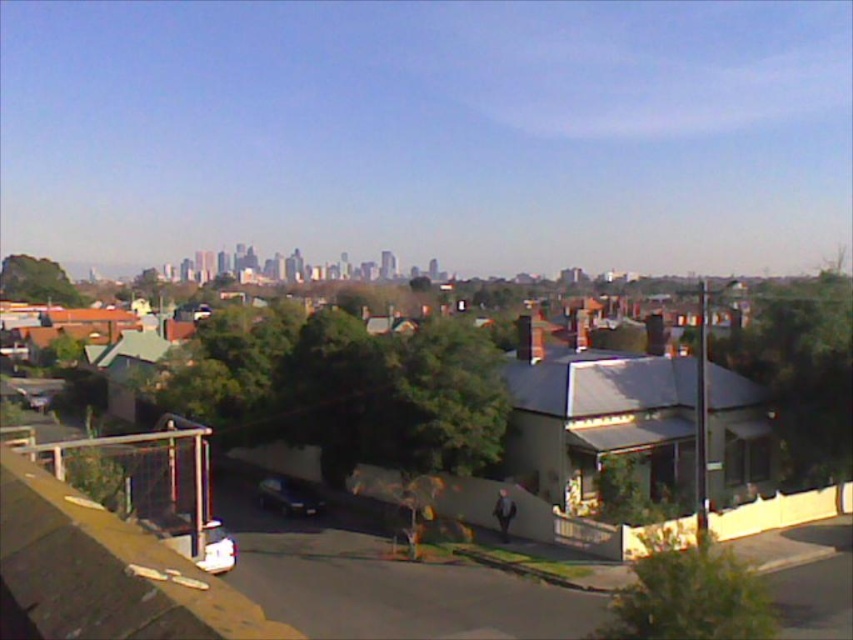
Identify the location of shiny black car at lower center. (289, 497).

Measure the distance between shiny black car at lower center and shiny black car at lower left.

46.07 meters

Between point (281, 512) and point (38, 392), which one is positioned behind?

Positioned behind is point (38, 392).

I want to click on shiny black car at lower center, so click(x=289, y=497).

Can you confirm if white matte car at lower center is positioned to the right of shiny black car at lower left?

Correct, you'll find white matte car at lower center to the right of shiny black car at lower left.

Who is lower down, white matte car at lower center or shiny black car at lower left?

Positioned lower is shiny black car at lower left.

Who is more forward, (202, 564) or (24, 401)?

Point (202, 564) is in front.

The height and width of the screenshot is (640, 853). I want to click on white matte car at lower center, so click(216, 548).

Can you confirm if shiny black car at lower center is shorter than white matte car at lower center?

Yes.

Does shiny black car at lower center have a lesser width compared to white matte car at lower center?

Indeed, shiny black car at lower center has a lesser width compared to white matte car at lower center.

Is point (300, 486) positioned in front of point (206, 528)?

No, it is behind (206, 528).

Identify the location of shiny black car at lower center. This screenshot has width=853, height=640. (289, 497).